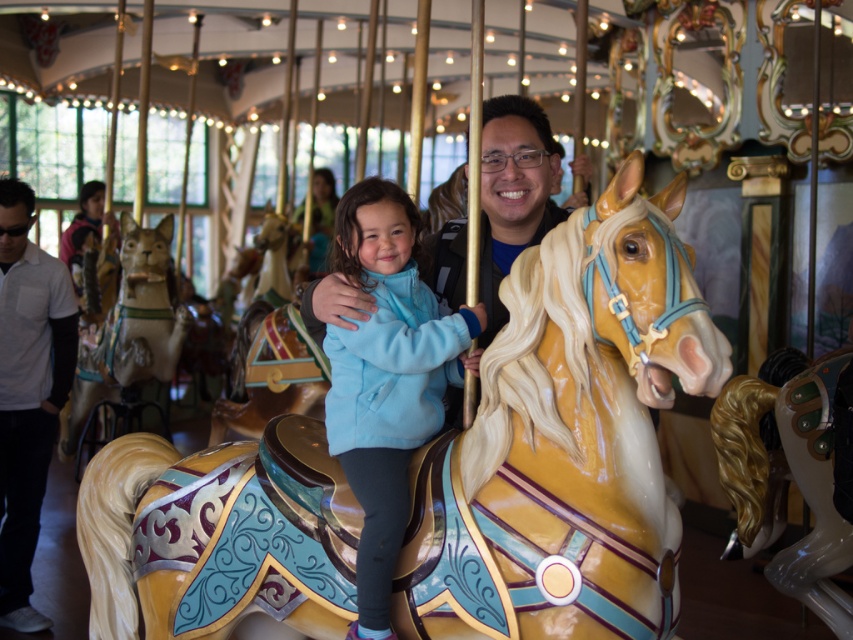
Does shiny gold mane at center have a lesser height compared to wooden horse at center?

No.

Which is in front, point (775, 396) or point (143, 353)?

Point (775, 396) is more forward.

Does point (712, 433) come in front of point (85, 397)?

Yes.

The height and width of the screenshot is (640, 853). I want to click on shiny gold mane at center, so click(786, 481).

Which is more to the left, shiny gold horse at center or wooden horse at center?

Positioned to the left is wooden horse at center.

Based on the photo, is shiny gold horse at center below wooden horse at center?

Correct, shiny gold horse at center is located below wooden horse at center.

At what (x,y) coordinates should I click in order to perform the action: click on shiny gold horse at center. Please return your answer as a coordinate pair (x, y). Looking at the image, I should click on (566, 440).

The width and height of the screenshot is (853, 640). What are the coordinates of `shiny gold horse at center` in the screenshot? It's located at (566, 440).

Can you confirm if shiny gold horse at center is smaller than light blue fleece jacket at center?

Incorrect, shiny gold horse at center is not smaller in size than light blue fleece jacket at center.

This screenshot has width=853, height=640. Find the location of `shiny gold horse at center`. shiny gold horse at center is located at coordinates (566, 440).